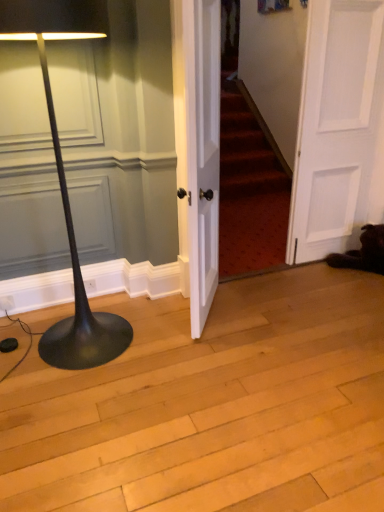
What do you see at coordinates (66, 186) in the screenshot?
I see `black matte floor lamp at left` at bounding box center [66, 186].

Locate an element on the screen. Image resolution: width=384 pixels, height=512 pixels. white wood door at center, the second door when ordered from right to left is located at coordinates (197, 145).

Describe the element at coordinates (197, 145) in the screenshot. The height and width of the screenshot is (512, 384). I see `white wood door at center, the first door positioned from the left` at that location.

Find the location of a particular element. black matte floor lamp at left is located at coordinates (x=66, y=186).

Are white wood door at center, the second door when ordered from right to left, and black matte floor lamp at left beside each other?

No, white wood door at center, the second door when ordered from right to left, is not in contact with black matte floor lamp at left.

Is white wood door at center, the first door positioned from the left, to the right of black matte floor lamp at left from the viewer's perspective?

Indeed, white wood door at center, the first door positioned from the left, is positioned on the right side of black matte floor lamp at left.

Is black matte floor lamp at left located within white wood door at center, the first door positioned from the left?

Definitely not — black matte floor lamp at left is not inside white wood door at center, the first door positioned from the left.

Considering the positions of objects black matte floor lamp at left and white matte door at right, which is counted as the 2th door, starting from the left, in the image provided, who is in front, black matte floor lamp at left or white matte door at right, which is counted as the 2th door, starting from the left,?

black matte floor lamp at left is in front.

From a real-world perspective, is black matte floor lamp at left under white matte door at right, acting as the 1th door starting from the right?

Yes, from a real-world perspective, black matte floor lamp at left is under white matte door at right, acting as the 1th door starting from the right.

Is black matte floor lamp at left taller or shorter than white matte door at right, acting as the 1th door starting from the right?

In the image, black matte floor lamp at left appears to be shorter than white matte door at right, acting as the 1th door starting from the right.

Can white matte door at right, acting as the 1th door starting from the right, be found inside black matte floor lamp at left?

No, white matte door at right, acting as the 1th door starting from the right, is not surrounded by black matte floor lamp at left.

Can you confirm if white matte door at right, acting as the 1th door starting from the right, is taller than white wood door at center, the second door when ordered from right to left?

Correct, white matte door at right, acting as the 1th door starting from the right, is much taller as white wood door at center, the second door when ordered from right to left.

Between white matte door at right, which is counted as the 2th door, starting from the left, and white wood door at center, the first door positioned from the left, which one has larger size?

With larger size is white wood door at center, the first door positioned from the left.

Considering the sizes of objects white matte door at right, which is counted as the 2th door, starting from the left, and white wood door at center, the second door when ordered from right to left, in the image provided, who is wider, white matte door at right, which is counted as the 2th door, starting from the left, or white wood door at center, the second door when ordered from right to left,?

Wider between the two is white wood door at center, the second door when ordered from right to left.

Locate an element on the screen. The width and height of the screenshot is (384, 512). door located behind the white wood door at center, the first door positioned from the left is located at coordinates (339, 130).

From the image's perspective, is black matte floor lamp at left on white wood door at center, the second door when ordered from right to left?

No.

From a real-world perspective, is black matte floor lamp at left positioned over white wood door at center, the first door positioned from the left, based on gravity?

No, from a real-world perspective, black matte floor lamp at left is not on top of white wood door at center, the first door positioned from the left.

Based on the photo, is black matte floor lamp at left not close to white wood door at center, the second door when ordered from right to left?

black matte floor lamp at left is near white wood door at center, the second door when ordered from right to left, not far away.

Could you tell me if black matte floor lamp at left is facing white wood door at center, the second door when ordered from right to left?

No, black matte floor lamp at left is not aimed at white wood door at center, the second door when ordered from right to left.

This screenshot has height=512, width=384. I want to click on door lying behind the white wood door at center, the first door positioned from the left, so pyautogui.click(x=339, y=130).

From a real-world perspective, which object stands above the other?

In real-world perspective, white matte door at right, which is counted as the 2th door, starting from the left, is above.

From the image's perspective, who appears lower, white wood door at center, the second door when ordered from right to left, or white matte door at right, acting as the 1th door starting from the right?

white wood door at center, the second door when ordered from right to left.

Does white wood door at center, the second door when ordered from right to left, have a greater width compared to white matte door at right, which is counted as the 2th door, starting from the left?

Yes.

From a real-world perspective, is white matte door at right, which is counted as the 2th door, starting from the left, positioned under black matte floor lamp at left based on gravity?

No, from a real-world perspective, white matte door at right, which is counted as the 2th door, starting from the left, is not beneath black matte floor lamp at left.

Can you confirm if white matte door at right, which is counted as the 2th door, starting from the left, is wider than black matte floor lamp at left?

Incorrect, the width of white matte door at right, which is counted as the 2th door, starting from the left, does not surpass that of black matte floor lamp at left.

Looking at this image, is white matte door at right, acting as the 1th door starting from the right, facing towards black matte floor lamp at left?

No, white matte door at right, acting as the 1th door starting from the right, is not turned towards black matte floor lamp at left.

Could black matte floor lamp at left be considered to be inside white matte door at right, acting as the 1th door starting from the right?

Definitely not — black matte floor lamp at left is not inside white matte door at right, acting as the 1th door starting from the right.

The width and height of the screenshot is (384, 512). Find the location of `lamp below the white wood door at center, the first door positioned from the left (from a real-world perspective)`. lamp below the white wood door at center, the first door positioned from the left (from a real-world perspective) is located at coordinates (66, 186).

Which door is the 2nd one when counting from the right side of the black matte floor lamp at left? Please provide its 2D coordinates.

[(339, 130)]

Consider the image. From the image, which object appears to be nearer to black matte floor lamp at left, white matte door at right, which is counted as the 2th door, starting from the left, or white wood door at center, the first door positioned from the left?

The object closer to black matte floor lamp at left is white wood door at center, the first door positioned from the left.

Based on their spatial positions, is white wood door at center, the second door when ordered from right to left, or black matte floor lamp at left closer to white matte door at right, which is counted as the 2th door, starting from the left?

white wood door at center, the second door when ordered from right to left, is closer to white matte door at right, which is counted as the 2th door, starting from the left.

From the image, which object appears to be nearer to white wood door at center, the first door positioned from the left, white matte door at right, which is counted as the 2th door, starting from the left, or black matte floor lamp at left?

→ black matte floor lamp at left.

Looking at the image, which one is located further to white matte door at right, acting as the 1th door starting from the right, black matte floor lamp at left or white wood door at center, the second door when ordered from right to left?

black matte floor lamp at left lies further to white matte door at right, acting as the 1th door starting from the right, than the other object.

Looking at the image, which one is located closer to white wood door at center, the first door positioned from the left, black matte floor lamp at left or white matte door at right, which is counted as the 2th door, starting from the left?

The object closer to white wood door at center, the first door positioned from the left, is black matte floor lamp at left.

Considering their positions, is white wood door at center, the first door positioned from the left, positioned closer to black matte floor lamp at left than white matte door at right, acting as the 1th door starting from the right?

white wood door at center, the first door positioned from the left.

Locate an element on the screen. The image size is (384, 512). door situated between black matte floor lamp at left and white matte door at right, which is counted as the 2th door, starting from the left, from left to right is located at coordinates (197, 145).